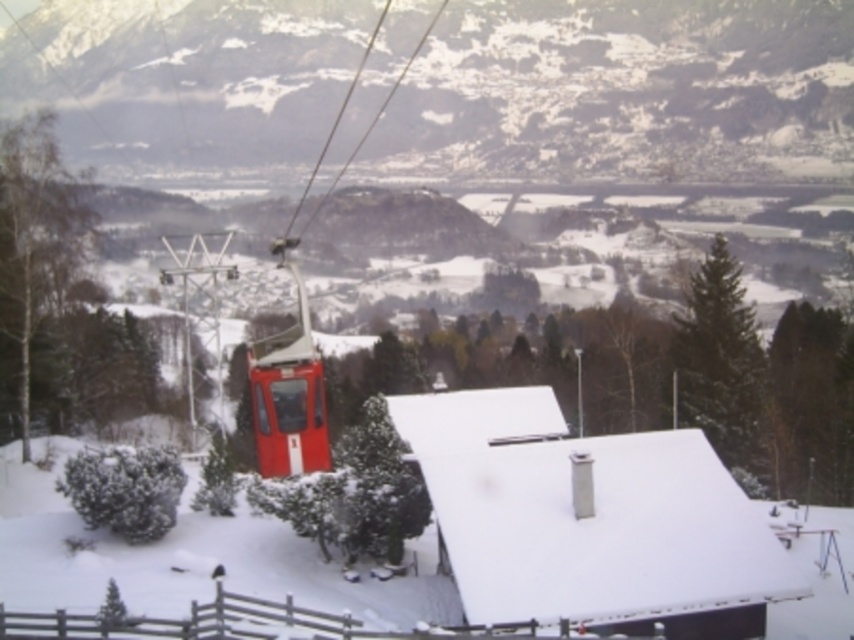
You are planning to install a new sign at the cable car station. The sign needs to be placed where it can be seen clearly from both the white matte roof at center and the brown wooden fence at lower center. Considering their sizes, which object should the sign be placed closer to for optimal visibility?

The sign should be placed closer to the white matte roof at center because it is larger in size than the brown wooden fence at lower center, making it a better reference point for visibility.

You are standing at the wooden fence and looking towards the cable car station. There are two points marked on the cable lines. Which point, point (740, 636) or point (279, 604), is closer to you?

Point (740, 636) is closer to the camera than point (279, 604), so it is closer to you.